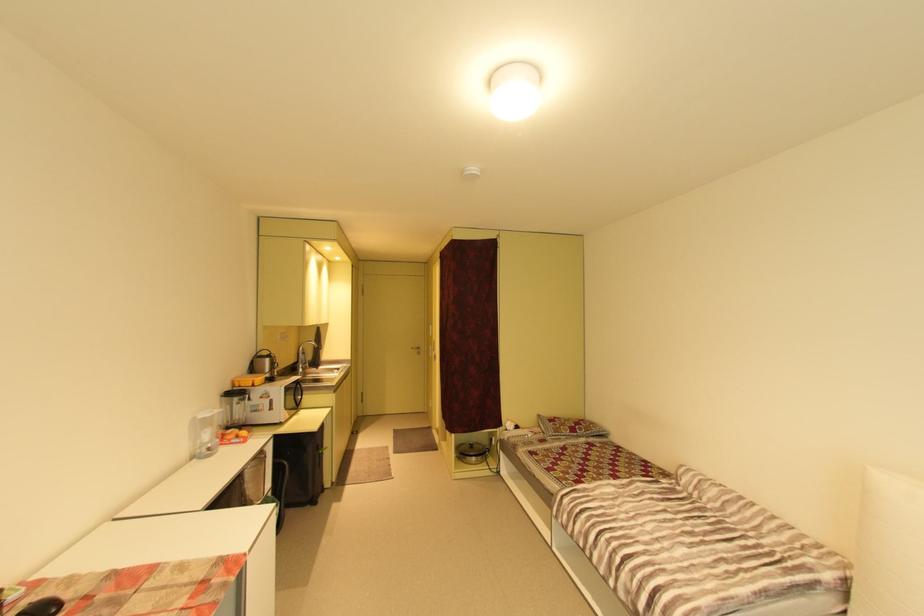
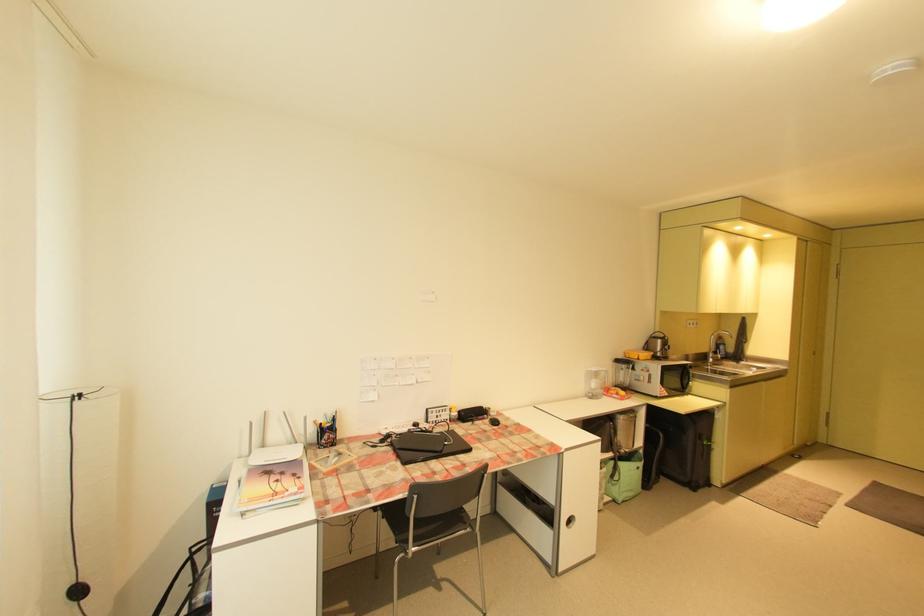
The point at (299,398) is marked in the first image. Where is the corresponding point in the second image?

(686, 381)